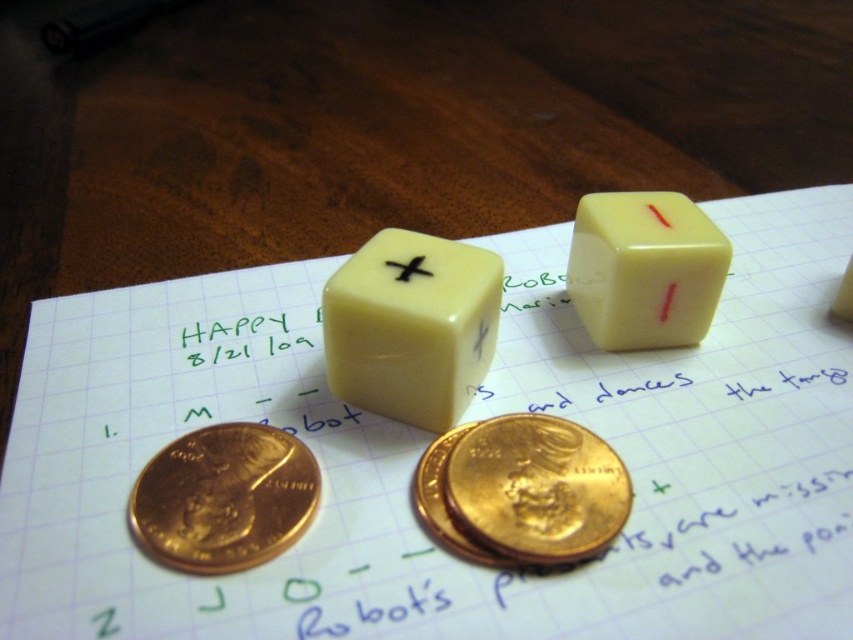
Question: Is black matte x at center further to the viewer compared to white plastic die at center?

Choices:
 (A) yes
 (B) no

Answer: (B)

Question: Is matte yellow die at center positioned in front of gold metallic coin at center?

Choices:
 (A) no
 (B) yes

Answer: (A)

Question: Is yellow matte dice at center positioned behind white plastic die at center?

Choices:
 (A) no
 (B) yes

Answer: (B)

Question: Which is nearer to the white plastic die at center?

Choices:
 (A) yellow matte dice at center
 (B) matte yellow die at center
 (C) black matte x at center
 (D) gold metallic penny at lower left

Answer: (B)

Question: Among these points, which one is farthest from the camera?

Choices:
 (A) pos(543,513)
 (B) pos(397,268)
 (C) pos(654,227)

Answer: (C)

Question: Which object appears farthest from the camera in this image?

Choices:
 (A) black matte x at center
 (B) yellow matte dice at center
 (C) gold metallic coin at center
 (D) matte yellow die at center

Answer: (B)